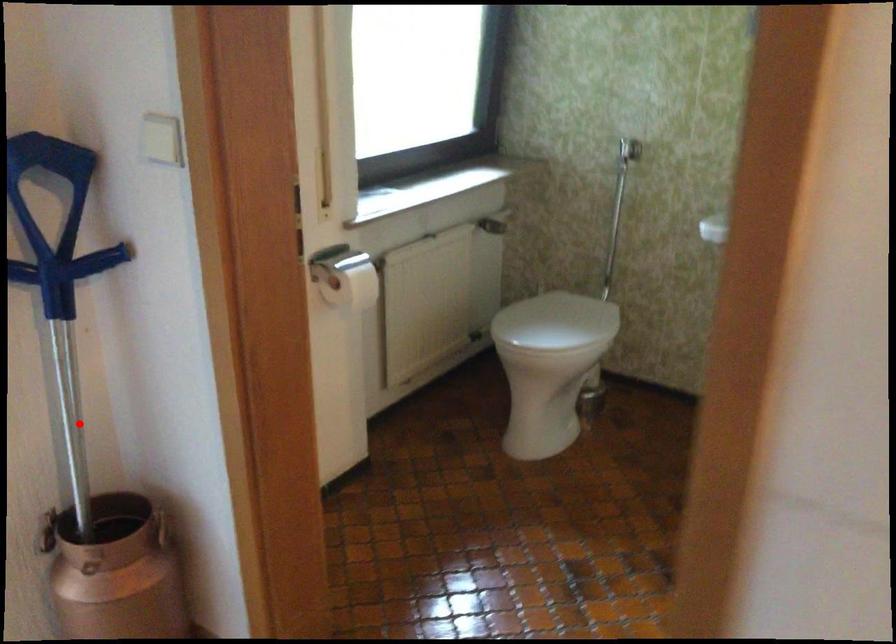
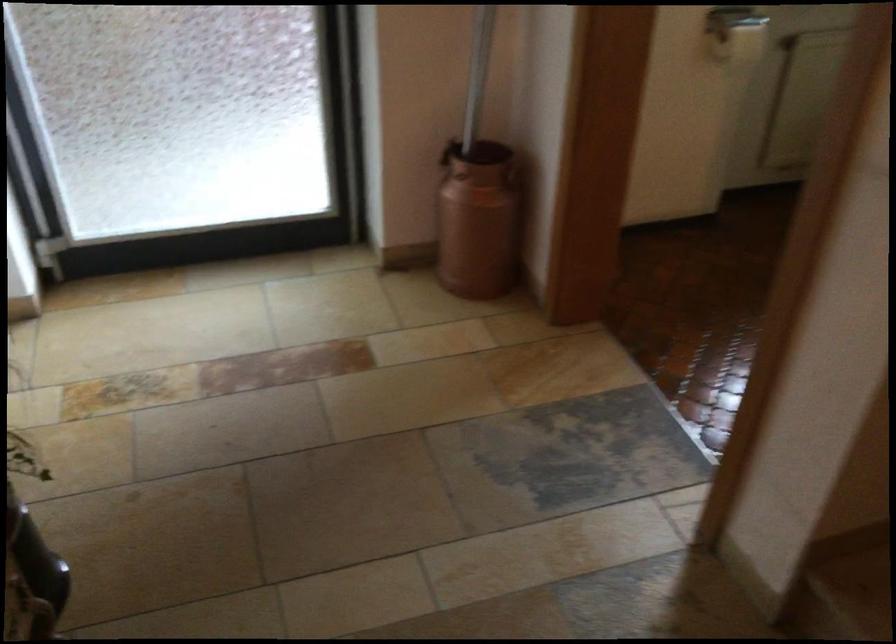
The point at the highlighted location is marked in the first image. Where is the corresponding point in the second image?

(478, 73)